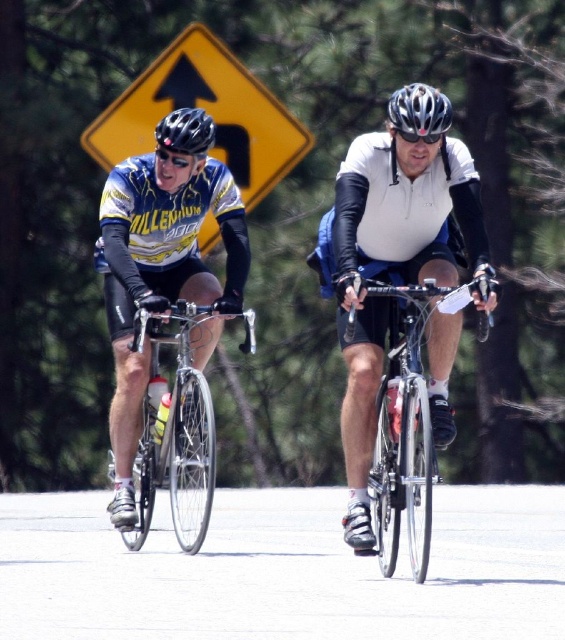
Measure the distance between yellow/yellowish plastic sign at upper center and black matte bicycle helmet at center.

7.03 meters

Who is more forward, (x=97, y=163) or (x=441, y=132)?

Point (x=441, y=132) is more forward.

Where is `yellow/yellowish plastic sign at upper center`? Image resolution: width=565 pixels, height=640 pixels. yellow/yellowish plastic sign at upper center is located at coordinates (207, 113).

Is yellow/yellowish plastic sign at upper center smaller than shiny silver bicycle at center?

No.

Can you confirm if yellow/yellowish plastic sign at upper center is positioned to the right of shiny silver bicycle at center?

Incorrect, yellow/yellowish plastic sign at upper center is not on the right side of shiny silver bicycle at center.

Where is `yellow/yellowish plastic sign at upper center`? The image size is (565, 640). yellow/yellowish plastic sign at upper center is located at coordinates (207, 113).

Which of these two, shiny silver bicycle at center or black matte bicycle helmet at center, stands shorter?

shiny silver bicycle at center

Does shiny silver bicycle at center appear on the left side of black matte bicycle helmet at center?

Yes, shiny silver bicycle at center is to the left of black matte bicycle helmet at center.

You are a GUI agent. You are given a task and a screenshot of the screen. Output one action in this format:
    pyautogui.click(x=<x>, y=<y>)
    Task: Click on the shiny silver bicycle at center
    This screenshot has height=640, width=565.
    Given the screenshot: What is the action you would take?
    pyautogui.click(x=407, y=419)